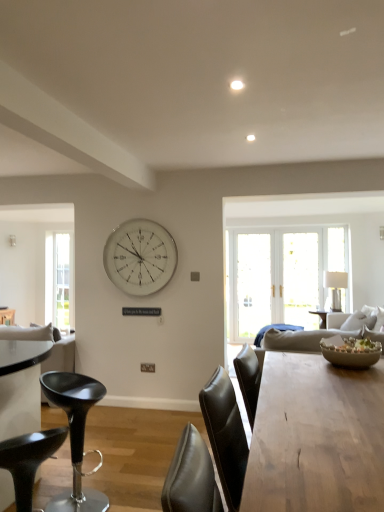
Question: In terms of size, does black leather stool at lower left, the second chair in the back-to-front sequence, appear bigger or smaller than white glossy lamp at right?

Choices:
 (A) big
 (B) small

Answer: (B)

Question: From a real-world perspective, relative to white glossy lamp at right, is black leather stool at lower left, the second chair in the back-to-front sequence, vertically above or below?

Choices:
 (A) below
 (B) above

Answer: (A)

Question: Which of these objects is positioned farthest from the white glossy lamp at right?

Choices:
 (A) beige ceramic bowl at lower right
 (B) wooden table at center
 (C) black leather stool at lower left, which is the 2th chair in front-to-back order
 (D) clear glass window at left
 (E) silver metallic clock at center

Answer: (D)

Question: Which object is the farthest from the black leather stool at lower left, positioned as the first chair in front-to-back order?

Choices:
 (A) black leather stool at lower left, the first chair from the back
 (B) clear glass window at left
 (C) beige ceramic bowl at lower right
 (D) white glossy lamp at right
 (E) wooden table at center

Answer: (B)